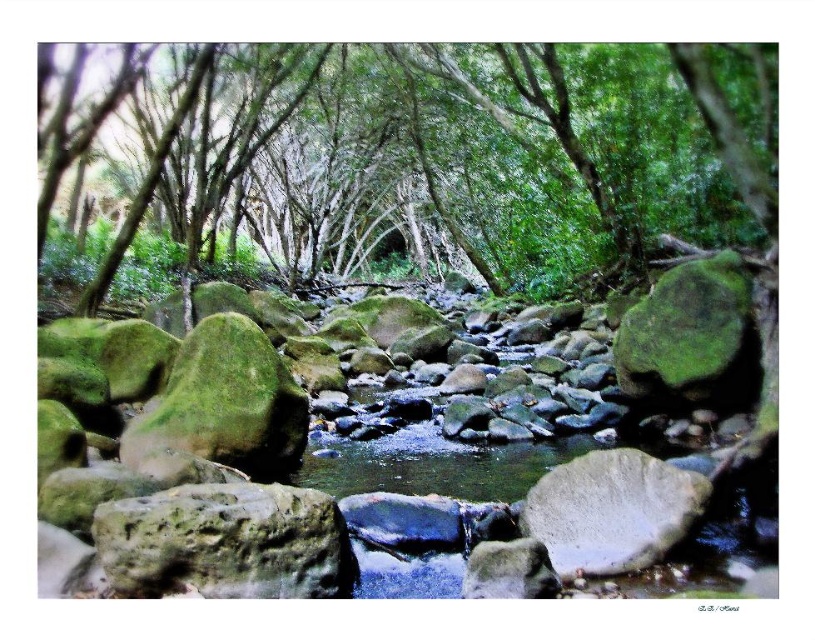
Question: Considering the real-world distances, which object is farthest from the white smooth rock at center?

Choices:
 (A) green mossy tree at center
 (B) green mossy rock at lower left

Answer: (A)

Question: Which of the following is the closest to the observer?

Choices:
 (A) (381, 81)
 (B) (659, 484)

Answer: (B)

Question: Which object is closer to the camera taking this photo?

Choices:
 (A) green mossy tree at center
 (B) white smooth rock at center
 (C) green mossy rock at lower left

Answer: (C)

Question: Can you confirm if green mossy tree at center is positioned below white smooth rock at center?

Choices:
 (A) yes
 (B) no

Answer: (B)

Question: Is green mossy tree at center below green mossy rock at lower left?

Choices:
 (A) yes
 (B) no

Answer: (B)

Question: Does green mossy tree at center come behind white smooth rock at center?

Choices:
 (A) yes
 (B) no

Answer: (A)